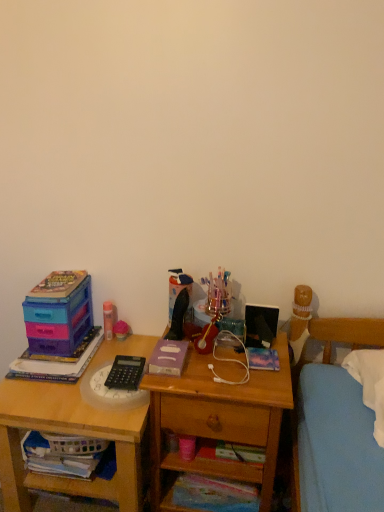
Question: Is wooden desk at left situated inside black plastic calculator at center, the 2th stationery when ordered from top to bottom, or outside?

Choices:
 (A) inside
 (B) outside

Answer: (B)

Question: Visually, is wooden desk at left positioned to the left or to the right of black plastic calculator at center, which is the first stationery in right-to-left order?

Choices:
 (A) right
 (B) left

Answer: (B)

Question: Considering the real-world distances, which object is closest to the black plastic calculator at center, which appears as the second stationery when viewed from the left?

Choices:
 (A) purple matte book at center, the 3th book when ordered from right to left
 (B) white fabric book at lower left, which is counted as the fourth book, starting from the right
 (C) matte plastic toy at center
 (D) wooden drawer at lower center
 (E) pink matte glue stick at upper left, placed as the 1th stationery when sorted from top to bottom

Answer: (A)

Question: Which object is positioned closest to the purple matte book at center, which is counted as the 1th book, starting from the top?

Choices:
 (A) matte purple plastic toy at left, the 3th book from the top
 (B) wooden drawer at lower center
 (C) multicolored paper book at lower center, the first book ordered from the bottom
 (D) wooden desk at left
 (E) matte plastic storage box at left

Answer: (B)